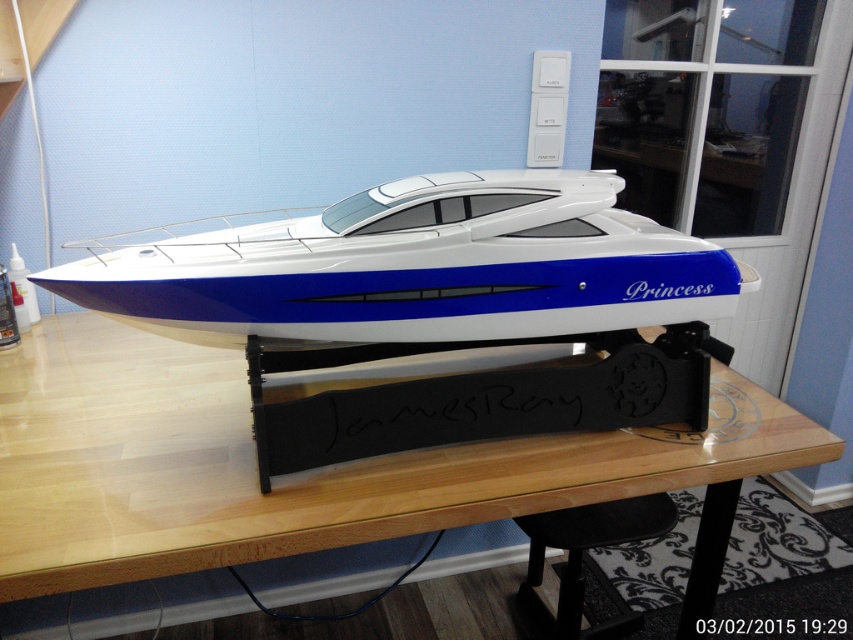
You are standing in front of a display case containing a model boat. The boat is mounted on a stand labeled with the name of the stand and has a decorative emblem. You need to place a small sticker exactly at the point with coordinates point (296, 458). If the sticker is 2 centimeters in diameter, will it fit without overlapping any part of the boat or the stand?

The point point (296, 458) is 98.94 centimeters from the viewer. Since the sticker is only 2 centimeters in diameter, there is sufficient space to place it without overlapping the boat or the stand as the distance is more than enough to accommodate the sticker size.

You are a delivery person who needs to place a 18 inch long package on the wooden table at center. The black matte stool at lower center is in the way. Can you slide the package from the stool to the table without rotating it?

The distance between the wooden table at center and the black matte stool at lower center is 19.41 inches. Since the package is 18 inches long, it can be slid from the stool to the table without rotating because the distance is greater than the package length.